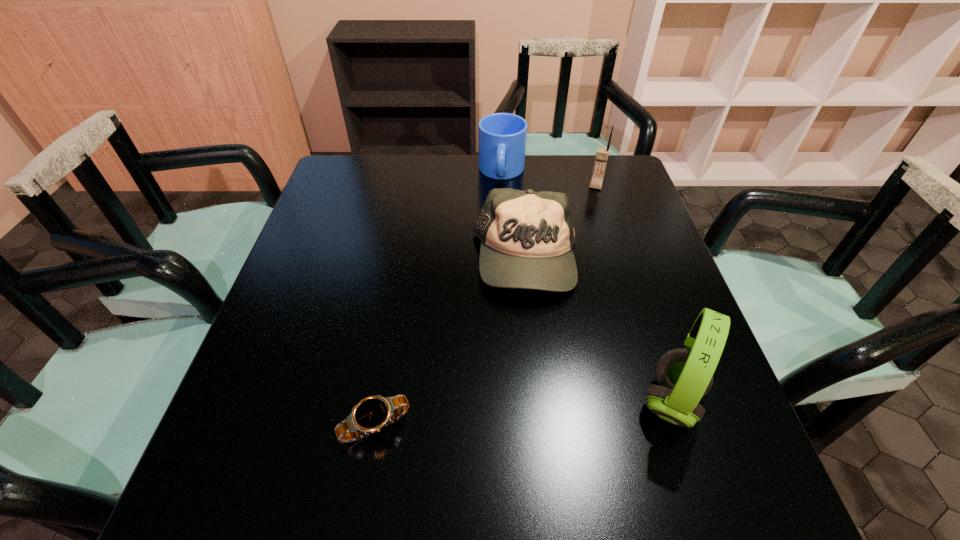
At what (x,y) coordinates should I click in order to perform the action: click on free space located 0.190m on the front of the cellular telephone, where the keypad is located. Please return your answer as a coordinate pair (x, y). This screenshot has width=960, height=540. Looking at the image, I should click on (586, 230).

The image size is (960, 540). I want to click on free spot located 0.090m on the front of the cellular telephone, where the keypad is located, so click(590, 208).

The image size is (960, 540). I want to click on vacant region located 0.050m on the front-facing side of the third farthest object, so click(515, 320).

At what (x,y) coordinates should I click in order to perform the action: click on vacant space located on the front-facing side of the third farthest object. Please return your answer as a coordinate pair (x, y). The width and height of the screenshot is (960, 540). Looking at the image, I should click on (506, 361).

At what (x,y) coordinates should I click in order to perform the action: click on free space located 0.240m on the front-facing side of the third farthest object. Please return your answer as a coordinate pair (x, y). Image resolution: width=960 pixels, height=540 pixels. Looking at the image, I should click on (499, 396).

Find the location of a particular element. free space located 0.270m on the side of the mug with the handle is located at coordinates 498,253.

The image size is (960, 540). What are the coordinates of `blank space located on the side of the mug with the handle` in the screenshot? It's located at (496, 291).

Locate an element on the screen. The height and width of the screenshot is (540, 960). free spot located 0.370m on the side of the mug with the handle is located at coordinates (497, 281).

The height and width of the screenshot is (540, 960). In order to click on cellular telephone that is at the far edge in this screenshot , I will do `click(602, 154)`.

You are a GUI agent. You are given a task and a screenshot of the screen. Output one action in this format:
    pyautogui.click(x=<x>, y=<y>)
    Task: Click on the mug that is positioned at the far edge
    The image size is (960, 540).
    Given the screenshot: What is the action you would take?
    pyautogui.click(x=502, y=137)